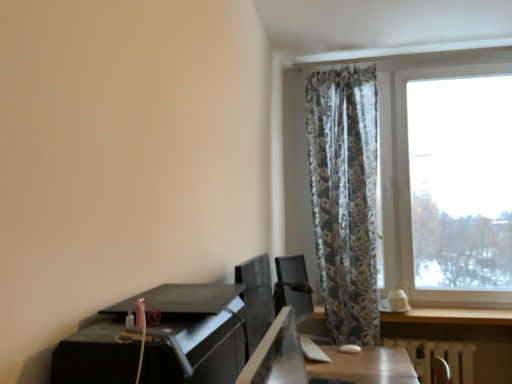
I want to click on blank space situated above white textured radiator at lower right (from a real-world perspective), so coord(429,336).